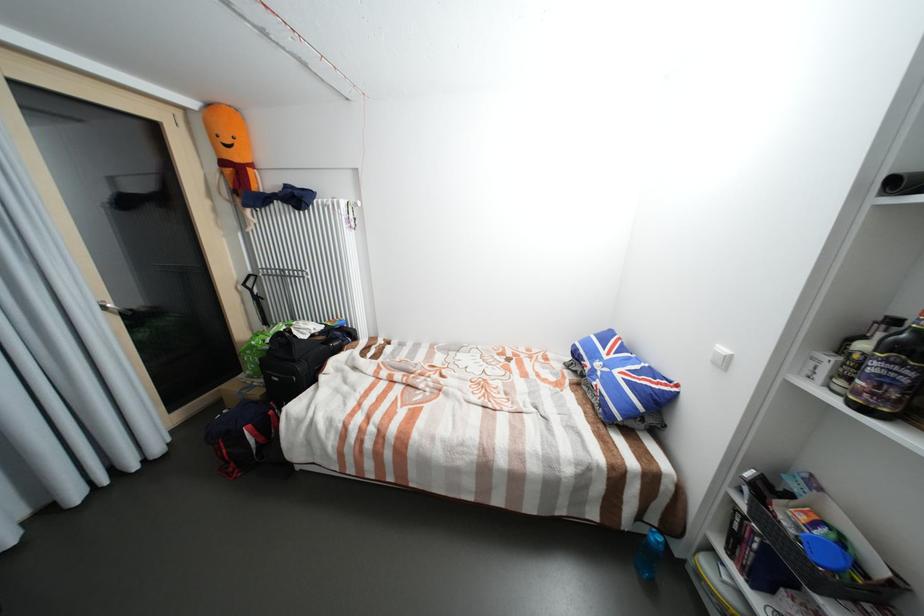
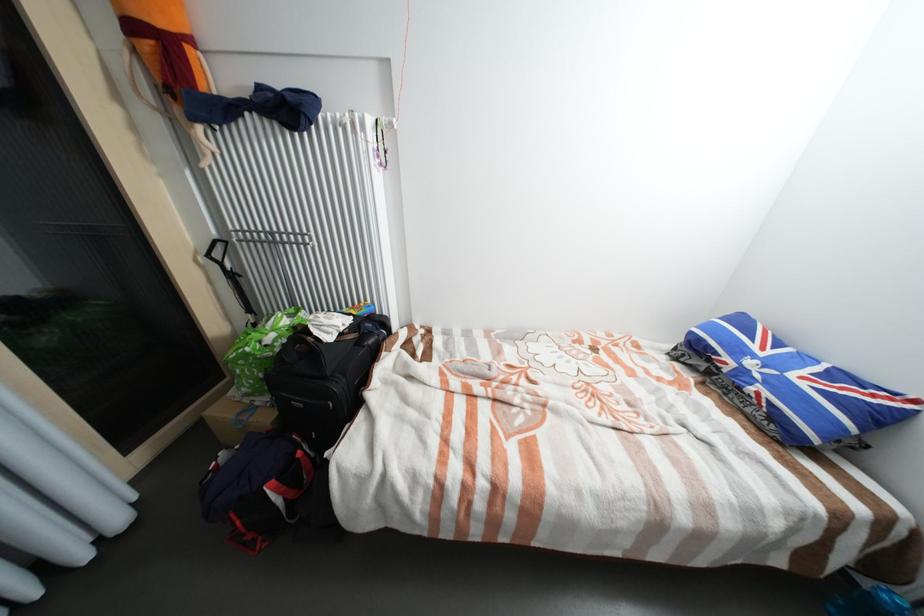
In the second image, find the point that corresponds to point (320, 336) in the first image.

(348, 334)